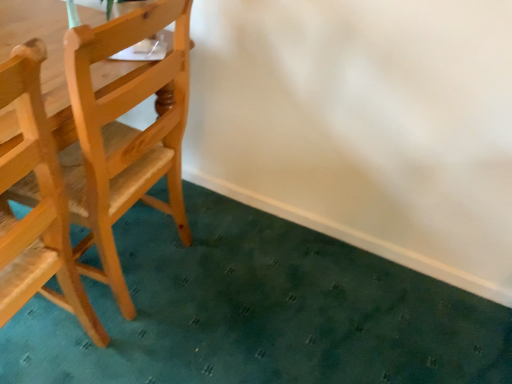
Question: Does light brown wood chair at left, acting as the 1th chair starting from the left, lie in front of natural wood chair at left, acting as the first chair starting from the right?

Choices:
 (A) no
 (B) yes

Answer: (B)

Question: Is light brown wood chair at left, acting as the 1th chair starting from the left, wider than natural wood chair at left, the 2th chair viewed from the left?

Choices:
 (A) yes
 (B) no

Answer: (B)

Question: From a real-world perspective, is light brown wood chair at left, arranged as the second chair when viewed from the right, physically above natural wood chair at left, the 2th chair viewed from the left?

Choices:
 (A) yes
 (B) no

Answer: (B)

Question: Is light brown wood chair at left, acting as the 1th chair starting from the left, positioned beyond the bounds of natural wood chair at left, acting as the first chair starting from the right?

Choices:
 (A) no
 (B) yes

Answer: (B)

Question: Is light brown wood chair at left, acting as the 1th chair starting from the left, positioned far away from natural wood chair at left, the 2th chair viewed from the left?

Choices:
 (A) no
 (B) yes

Answer: (A)

Question: Considering the relative positions of light brown wood chair at left, acting as the 1th chair starting from the left, and natural wood chair at left, the 2th chair viewed from the left, in the image provided, is light brown wood chair at left, acting as the 1th chair starting from the left, to the right of natural wood chair at left, the 2th chair viewed from the left, from the viewer's perspective?

Choices:
 (A) yes
 (B) no

Answer: (B)

Question: From the image's perspective, does natural wood chair at left, the 2th chair viewed from the left, appear higher than light brown wood chair at left, arranged as the second chair when viewed from the right?

Choices:
 (A) yes
 (B) no

Answer: (A)

Question: Considering the relative sizes of natural wood chair at left, acting as the first chair starting from the right, and light brown wood chair at left, arranged as the second chair when viewed from the right, in the image provided, is natural wood chair at left, acting as the first chair starting from the right, thinner than light brown wood chair at left, arranged as the second chair when viewed from the right,?

Choices:
 (A) no
 (B) yes

Answer: (A)

Question: Is natural wood chair at left, the 2th chair viewed from the left, placed right next to light brown wood chair at left, acting as the 1th chair starting from the left?

Choices:
 (A) yes
 (B) no

Answer: (B)

Question: Can you confirm if natural wood chair at left, the 2th chair viewed from the left, is smaller than light brown wood chair at left, acting as the 1th chair starting from the left?

Choices:
 (A) no
 (B) yes

Answer: (A)

Question: Is natural wood chair at left, acting as the first chair starting from the right, shorter than light brown wood chair at left, arranged as the second chair when viewed from the right?

Choices:
 (A) yes
 (B) no

Answer: (A)

Question: From a real-world perspective, is natural wood chair at left, acting as the first chair starting from the right, positioned over light brown wood chair at left, acting as the 1th chair starting from the left, based on gravity?

Choices:
 (A) no
 (B) yes

Answer: (B)

Question: Considering their positions, is natural wood chair at left, acting as the first chair starting from the right, located in front of or behind light brown wood chair at left, acting as the 1th chair starting from the left?

Choices:
 (A) front
 (B) behind

Answer: (B)